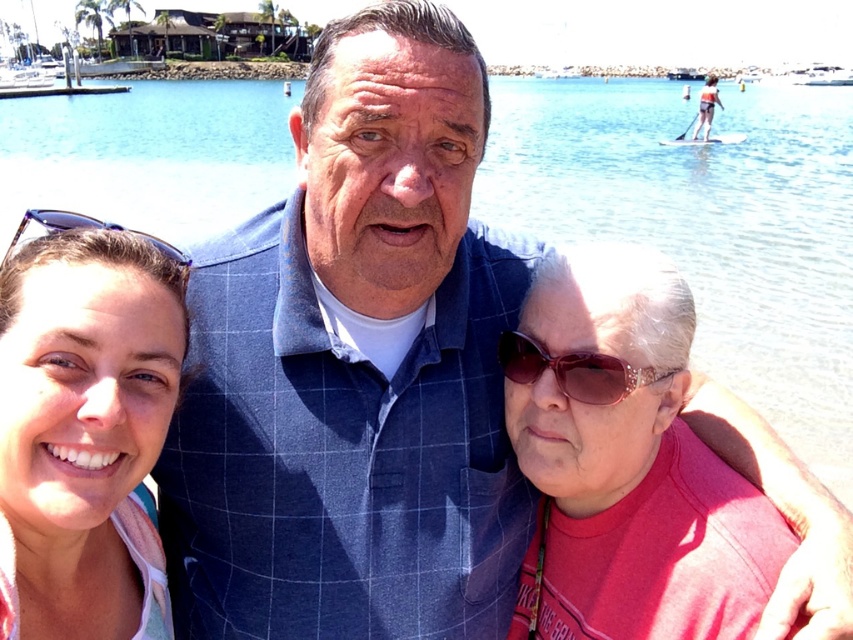
Is clear blue water at center below matte blue sunglasses at upper left?

Actually, clear blue water at center is above matte blue sunglasses at upper left.

Does clear blue water at center appear on the left side of matte blue sunglasses at upper left?

No, clear blue water at center is not to the left of matte blue sunglasses at upper left.

Is point (723, 304) farther from viewer compared to point (115, 448)?

Yes.

What are the coordinates of `clear blue water at center` in the screenshot? It's located at (706, 225).

Based on the photo, who is positioned more to the left, clear blue water at center or blue plastic sunglasses at left?

blue plastic sunglasses at left is more to the left.

Based on the photo, does clear blue water at center have a lesser width compared to blue plastic sunglasses at left?

In fact, clear blue water at center might be wider than blue plastic sunglasses at left.

Does point (790, 353) come farther from viewer compared to point (38, 211)?

Yes, it is behind point (38, 211).

This screenshot has width=853, height=640. Find the location of `clear blue water at center`. clear blue water at center is located at coordinates (706, 225).

Does matte pink shirt at center lie in front of pink fabric at upper right?

That is True.

Can you confirm if matte pink shirt at center is bigger than pink fabric at upper right?

Actually, matte pink shirt at center might be smaller than pink fabric at upper right.

Where is `matte pink shirt at center`? The width and height of the screenshot is (853, 640). matte pink shirt at center is located at coordinates (630, 460).

Locate an element on the screen. This screenshot has width=853, height=640. matte pink shirt at center is located at coordinates (630, 460).